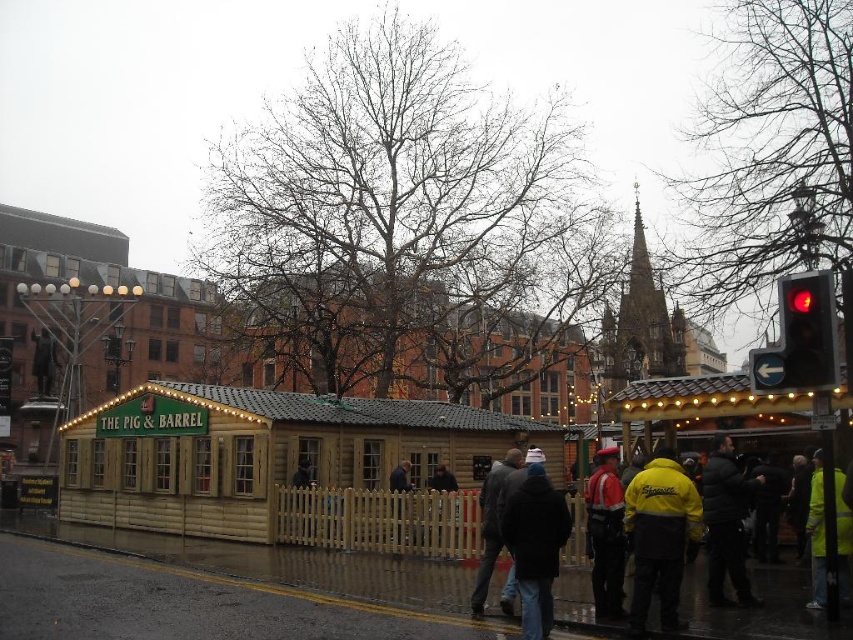
Question: Which is farther from the red glass traffic light at right?

Choices:
 (A) red reflective jacket at center
 (B) yellow fabric jacket at lower right

Answer: (A)

Question: Is yellow fabric jacket at lower right to the left of dark gray jacket at center from the viewer's perspective?

Choices:
 (A) no
 (B) yes

Answer: (A)

Question: Considering the relative positions of red glass traffic light at right and yellow reflective jacket at lower right in the image provided, where is red glass traffic light at right located with respect to yellow reflective jacket at lower right?

Choices:
 (A) left
 (B) right

Answer: (A)

Question: Which point is closer to the camera?

Choices:
 (A) (x=555, y=512)
 (B) (x=218, y=435)
 (C) (x=815, y=566)

Answer: (A)

Question: Observing the image, what is the correct spatial positioning of wooden cabin at center in reference to black puffer jacket at lower right?

Choices:
 (A) left
 (B) right

Answer: (A)

Question: Which object is closer to the camera taking this photo?

Choices:
 (A) black puffer jacket at lower right
 (B) yellow fabric jacket at lower right
 (C) yellow fabric tent at center right

Answer: (B)